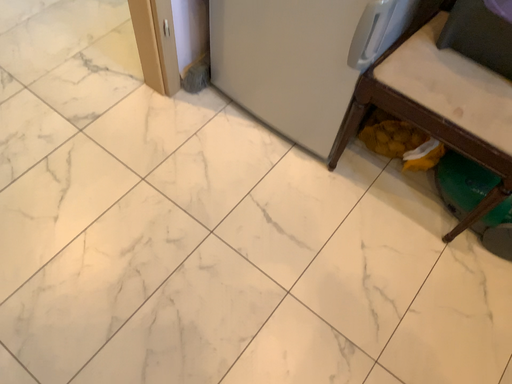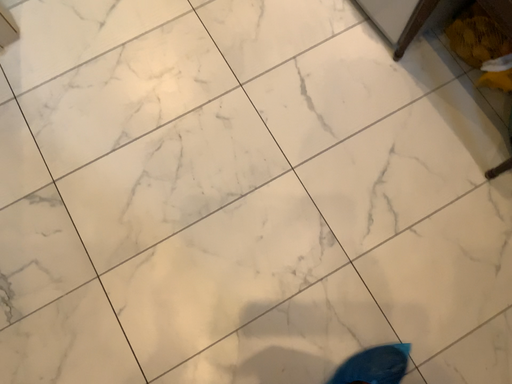
Question: Which way did the camera rotate in the video?

Choices:
 (A) rotated left
 (B) rotated right

Answer: (A)